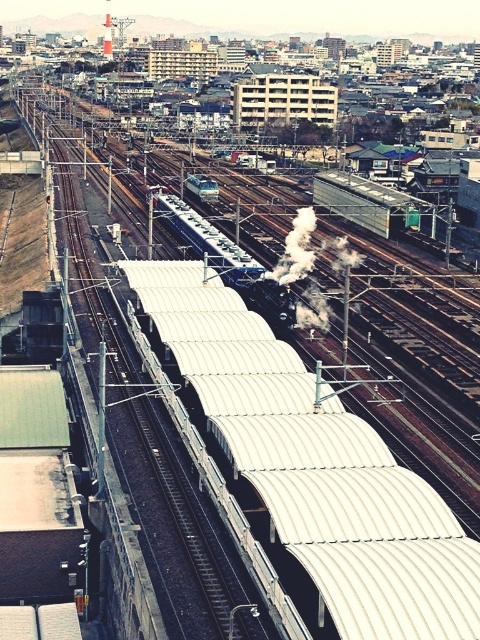
You are a drone operator flying a drone over an urban railway station. You notice the white corrugated roof at center and the white smoke at center. Which object is taller from the ground?

The white smoke at center is taller than the white corrugated roof at center according to the description.

You are a passenger on the train and want to look out the window to see both the white corrugated roof at center and the white smoke at center. Which object will appear larger in your view?

The white corrugated roof at center will appear larger because it is closer to the viewer than the white smoke at center.

You are standing at point A which is at coordinate point (335, 636) and need to walk to point B at coordinate point (303, 323). Based on the scene, which direction should you face to walk towards point B?

You should face towards the direction opposite of the train movement since point A is in front of point B along the tracks.